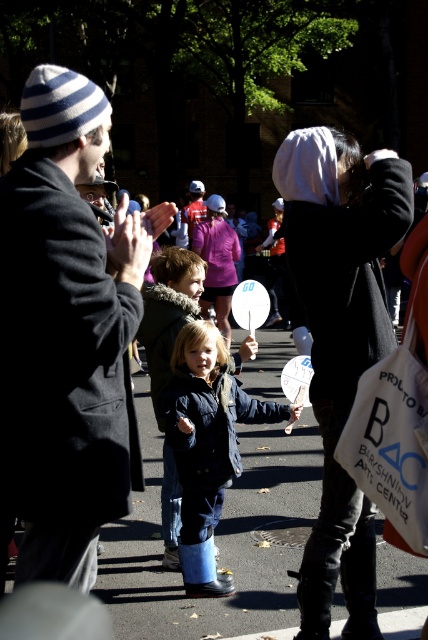
Is striped knit hat at upper left wider than dark blue jacket at center?

Indeed, striped knit hat at upper left has a greater width compared to dark blue jacket at center.

Who is lower down, striped knit hat at upper left or dark blue jacket at center?

dark blue jacket at center is below.

What do you see at coordinates (65, 336) in the screenshot? The height and width of the screenshot is (640, 428). I see `striped knit hat at upper left` at bounding box center [65, 336].

Locate an element on the screen. The image size is (428, 640). striped knit hat at upper left is located at coordinates (65, 336).

Which is more to the right, dark blue jacket at center or matte red helmet at center?

dark blue jacket at center is more to the right.

Is point (157, 262) farther from viewer compared to point (190, 211)?

No, (157, 262) is in front of (190, 211).

At what (x,y) coordinates should I click in order to perform the action: click on dark blue jacket at center. Please return your answer as a coordinate pair (x, y). Image resolution: width=428 pixels, height=640 pixels. Looking at the image, I should click on (169, 314).

Is point (392, 182) closer to viewer compared to point (172, 560)?

Yes, point (392, 182) is closer to viewer.

Locate an element on the screen. This screenshot has height=640, width=428. black fabric coat at center is located at coordinates (339, 340).

Does point (321, 204) lie in front of point (184, 250)?

Yes.

This screenshot has width=428, height=640. I want to click on black fabric coat at center, so pyautogui.click(x=339, y=340).